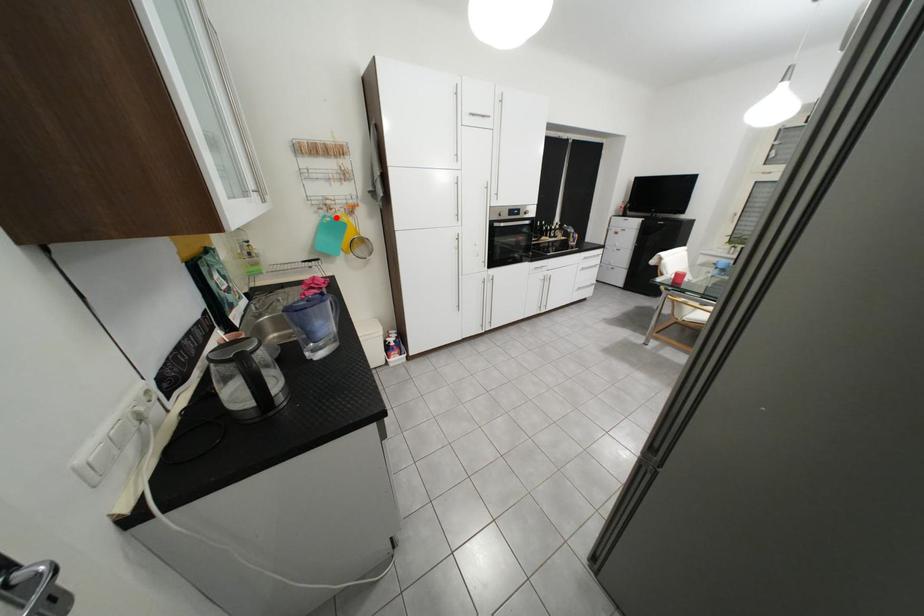
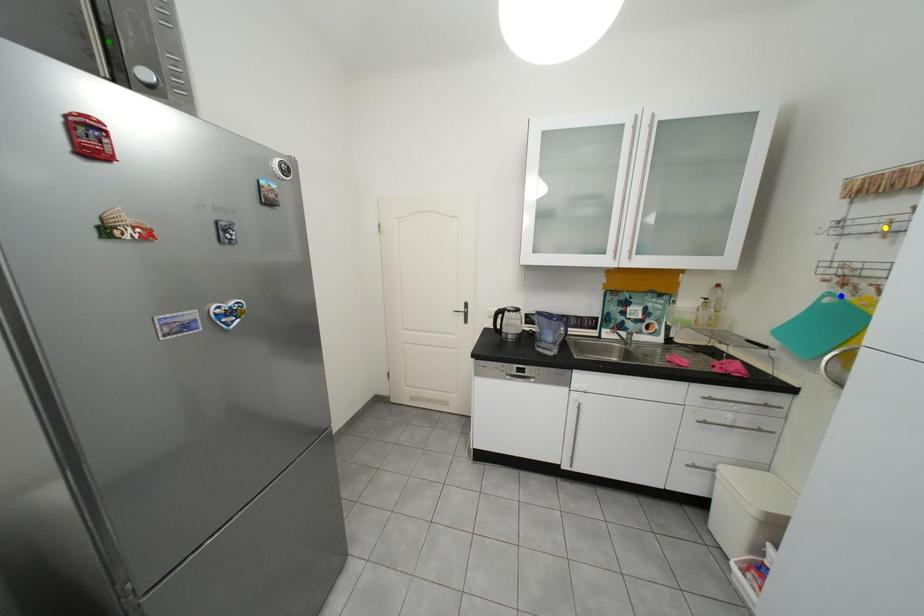
Question: I am providing you with two images of the same scene from different viewpoints. A red point is marked on the first image. You are given multiple points on the second image. Can you choose the point in image 2 that corresponds to the point in image 1?

Choices:
 (A) green point
 (B) yellow point
 (C) blue point

Answer: (C)